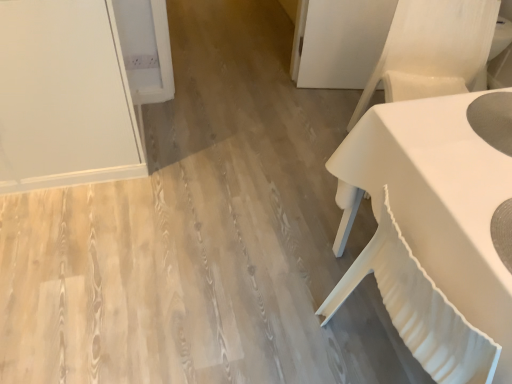
Question: Is the surface of white matte table at right in direct contact with white fabric armchair at right?

Choices:
 (A) yes
 (B) no

Answer: (B)

Question: From the image's perspective, is white matte table at right beneath white fabric armchair at right?

Choices:
 (A) yes
 (B) no

Answer: (A)

Question: From a real-world perspective, is white matte table at right over white fabric armchair at right?

Choices:
 (A) yes
 (B) no

Answer: (B)

Question: From the image's perspective, is white matte table at right over white fabric armchair at right?

Choices:
 (A) no
 (B) yes

Answer: (A)

Question: Can you confirm if white matte table at right is taller than white fabric armchair at right?

Choices:
 (A) no
 (B) yes

Answer: (B)

Question: Is white matte table at right shorter than white fabric armchair at right?

Choices:
 (A) no
 (B) yes

Answer: (A)

Question: Could white matte table at right be considered to be inside white fabric armchair at right?

Choices:
 (A) no
 (B) yes

Answer: (A)

Question: Can you confirm if white fabric armchair at right is bigger than white matte table at right?

Choices:
 (A) no
 (B) yes

Answer: (A)

Question: Could you tell me if white fabric armchair at right is facing white matte table at right?

Choices:
 (A) yes
 (B) no

Answer: (A)

Question: From the image's perspective, is white fabric armchair at right beneath white matte table at right?

Choices:
 (A) no
 (B) yes

Answer: (A)

Question: From the image's perspective, is white fabric armchair at right above white matte table at right?

Choices:
 (A) no
 (B) yes

Answer: (B)

Question: Is white fabric armchair at right not inside white matte table at right?

Choices:
 (A) no
 (B) yes

Answer: (B)

Question: Is white fabric armchair at right to the left or to the right of white matte table at right in the image?

Choices:
 (A) right
 (B) left

Answer: (A)